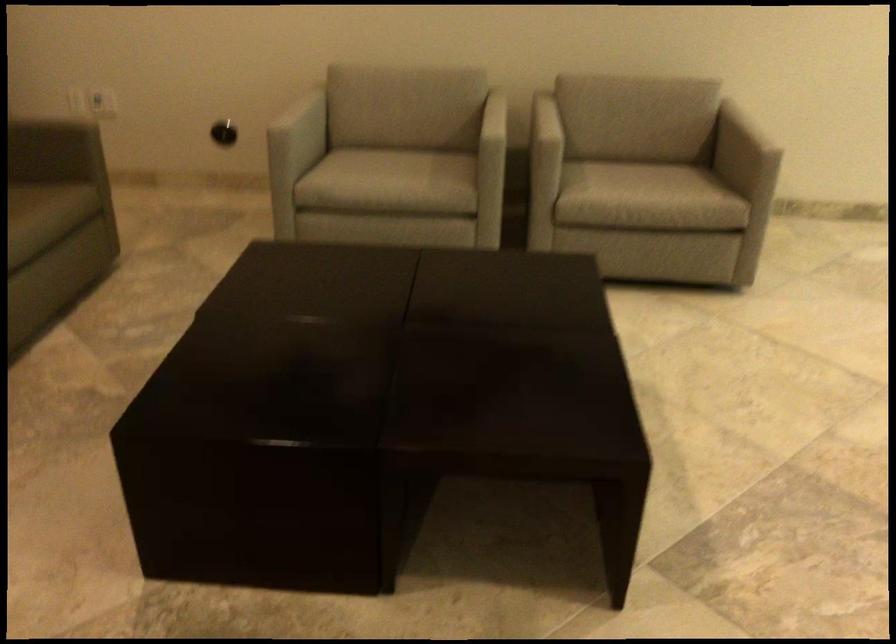
This screenshot has width=896, height=644. I want to click on sofa sitting surface, so click(x=36, y=219).